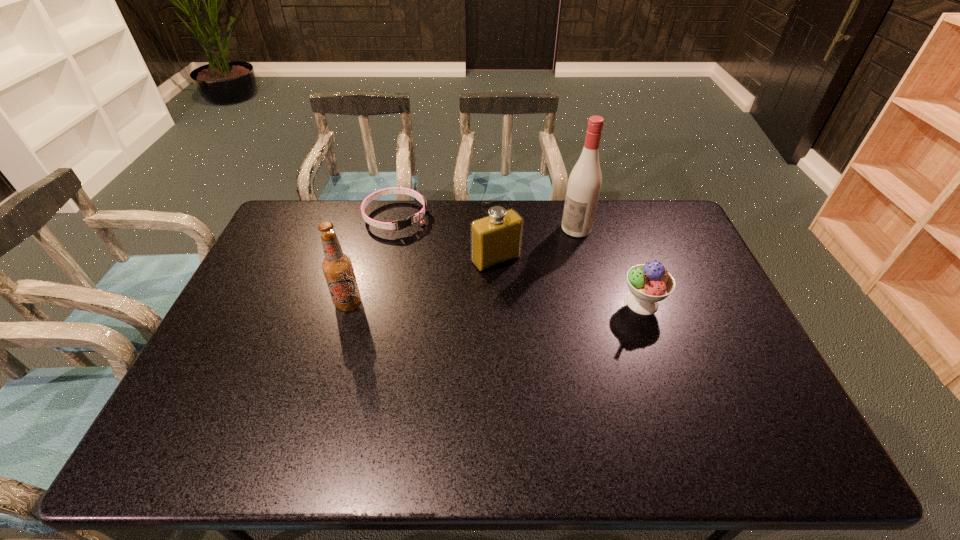
You are a GUI agent. You are given a task and a screenshot of the screen. Output one action in this format:
    pyautogui.click(x=<x>, y=<y>)
    Task: Click on the free space located on the front-facing side of the perfume
    The width and height of the screenshot is (960, 540).
    Given the screenshot: What is the action you would take?
    pyautogui.click(x=576, y=353)

Identify the location of free region located on the front-facing side of the perfume. The height and width of the screenshot is (540, 960). (574, 350).

Where is `free space located on the front-facing side of the perfume`? This screenshot has height=540, width=960. free space located on the front-facing side of the perfume is located at coordinates (578, 355).

I want to click on vacant area situated 0.160m with the buckle on the dog collar, so click(428, 260).

Where is `vacant space located 0.250m with the buckle on the dog collar`? Image resolution: width=960 pixels, height=540 pixels. vacant space located 0.250m with the buckle on the dog collar is located at coordinates (441, 275).

The height and width of the screenshot is (540, 960). In order to click on free space located 0.210m with the buckle on the dog collar in this screenshot , I will do point(435,268).

Identify the location of vacant space located 0.370m on the label of the tallest object. Image resolution: width=960 pixels, height=540 pixels. (492, 286).

Locate an element on the screen. This screenshot has width=960, height=540. vacant area situated on the label of the tallest object is located at coordinates (546, 249).

The width and height of the screenshot is (960, 540). What are the coordinates of `vacant space located 0.310m on the label of the tallest object` in the screenshot? It's located at point(506,277).

This screenshot has height=540, width=960. Identify the location of dog collar located in the far edge section of the desktop. (402, 223).